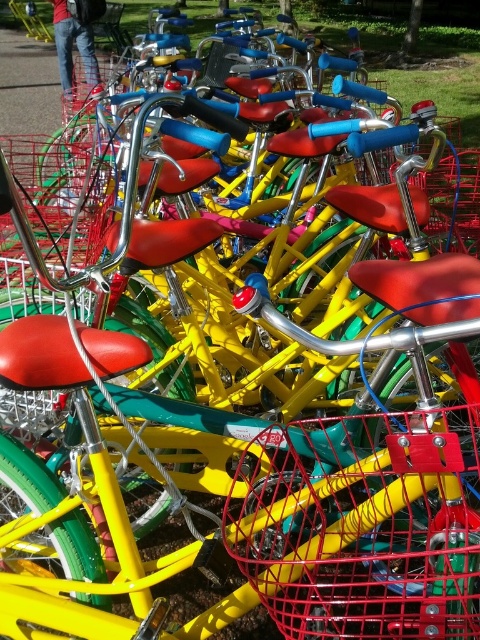
You are standing at point (29, 275) and want to walk to point (346, 468). Are you facing north, south, east, or west?

Since point (346, 468) is in front of point (29, 275), you must be facing north.

You are a cyclist who wants to find your red wire basket at center. You see another metallic wire basket at lower left. Which basket is positioned lower in the image?

The red wire basket at center is positioned lower than the metallic wire basket at lower left.